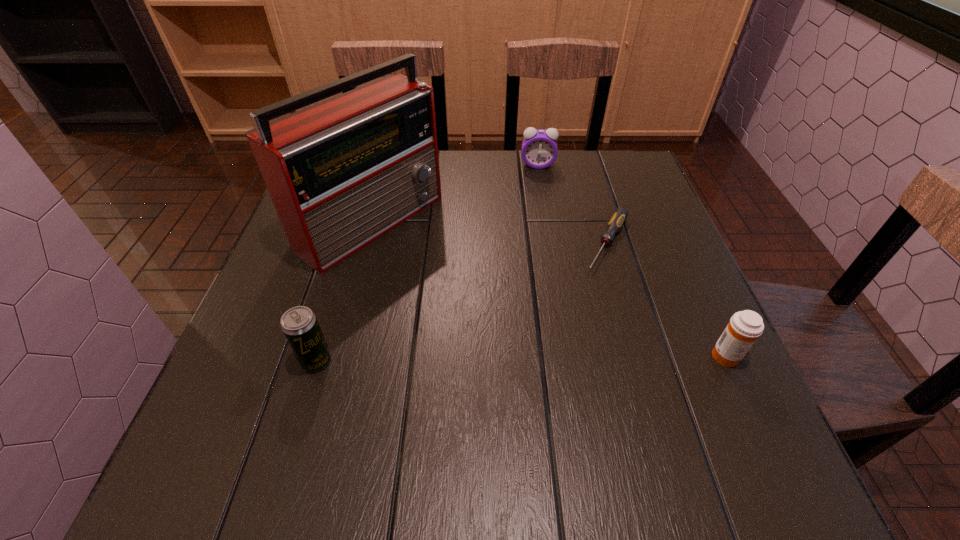
Find the location of `vacant point located between the rightmost object and the tallest object`. vacant point located between the rightmost object and the tallest object is located at coordinates (548, 289).

Identify the location of free space between the third object from left to right and the tallest object. (454, 193).

The width and height of the screenshot is (960, 540). In order to click on the third closest object to the medicine in this screenshot , I will do `click(539, 147)`.

Find the location of a particular element. The width and height of the screenshot is (960, 540). object that is the second closest to the shortest object is located at coordinates (539, 147).